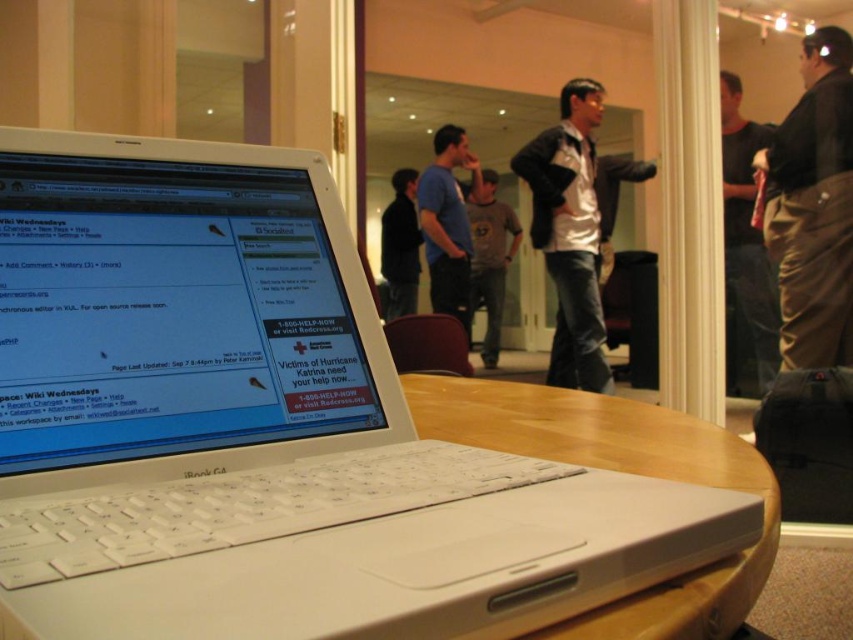
You are organizing a charity event and need to set up a donation station. You have a white plastic laptop at center and brown corduroy pants at right. Where should you place the laptop relative to the pants to ensure it is visible to people entering the room?

The white plastic laptop at center should be placed below the brown corduroy pants at right to ensure it is visible to people entering the room, as the laptop is located below the pants in the scene.